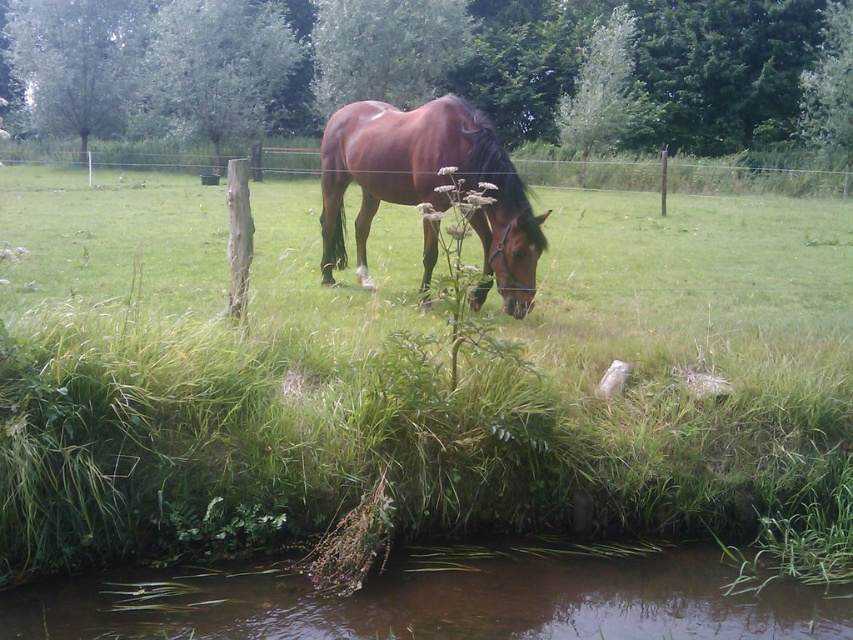
Does green grassy at center appear on the left side of shiny brown horse at center?

Incorrect, green grassy at center is not on the left side of shiny brown horse at center.

I want to click on green grassy at center, so click(415, 380).

Where is `green grassy at center`? This screenshot has width=853, height=640. green grassy at center is located at coordinates (415, 380).

Locate an element on the screen. green grassy at center is located at coordinates (415, 380).

Can you confirm if brown muddy water at lower center is taller than shiny brown horse at center?

Incorrect, brown muddy water at lower center's height is not larger of shiny brown horse at center's.

Does brown muddy water at lower center appear on the right side of shiny brown horse at center?

In fact, brown muddy water at lower center is to the left of shiny brown horse at center.

Locate an element on the screen. Image resolution: width=853 pixels, height=640 pixels. brown muddy water at lower center is located at coordinates (438, 602).

Locate an element on the screen. This screenshot has width=853, height=640. brown muddy water at lower center is located at coordinates click(438, 602).

Does green grassy at center come behind brown muddy water at lower center?

Yes, it is.

Does green grassy at center appear on the right side of brown muddy water at lower center?

Yes, green grassy at center is to the right of brown muddy water at lower center.

Is point (113, 292) farther from viewer compared to point (795, 625)?

Yes.

At what (x,y) coordinates should I click in order to perform the action: click on green grassy at center. Please return your answer as a coordinate pair (x, y). This screenshot has height=640, width=853. Looking at the image, I should click on (415, 380).